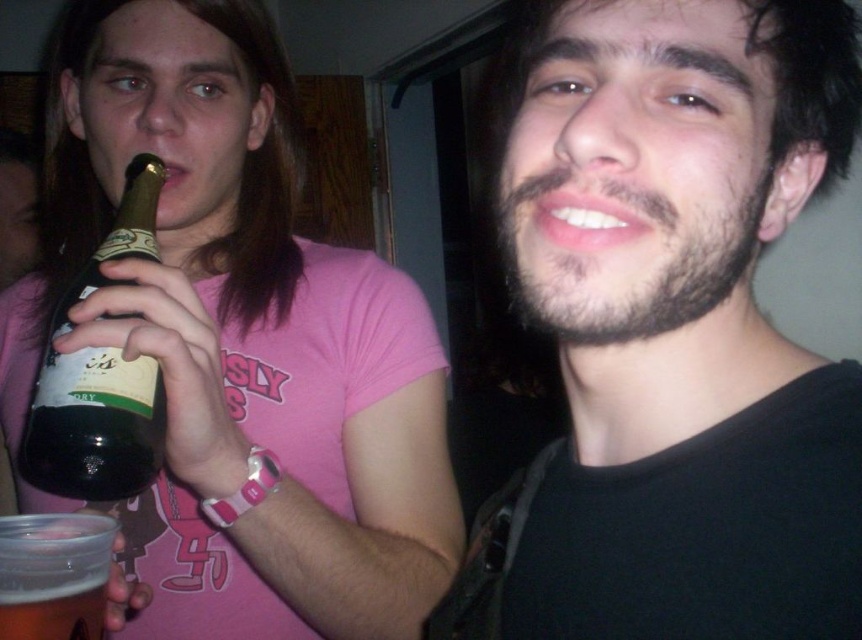
Looking at this image, you are at a party and want to grab a drink. You see the green glass bottle at left and the clear plastic cup at lower left. Which one is closer to you?

The green glass bottle at left is closer to you because the clear plastic cup at lower left is behind it.

You are at a party and need to place a 7.5 inch long object between the green glass bottle at left and the clear plastic cup at lower left. Can you fit it there?

The distance between the green glass bottle at left and the clear plastic cup at lower left is 6.80 inches, which is shorter than the 7.5 inch object. Therefore, the object cannot fit in that space.